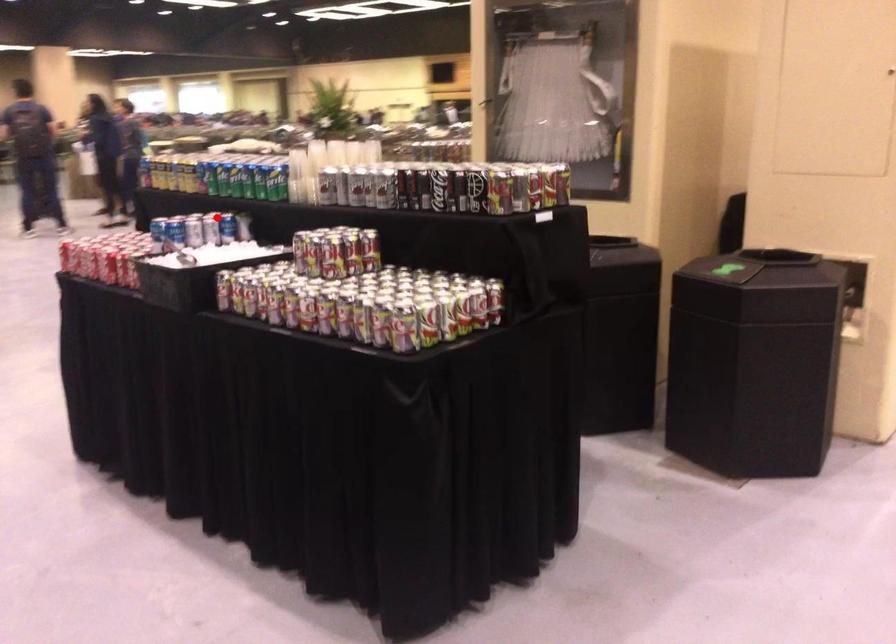
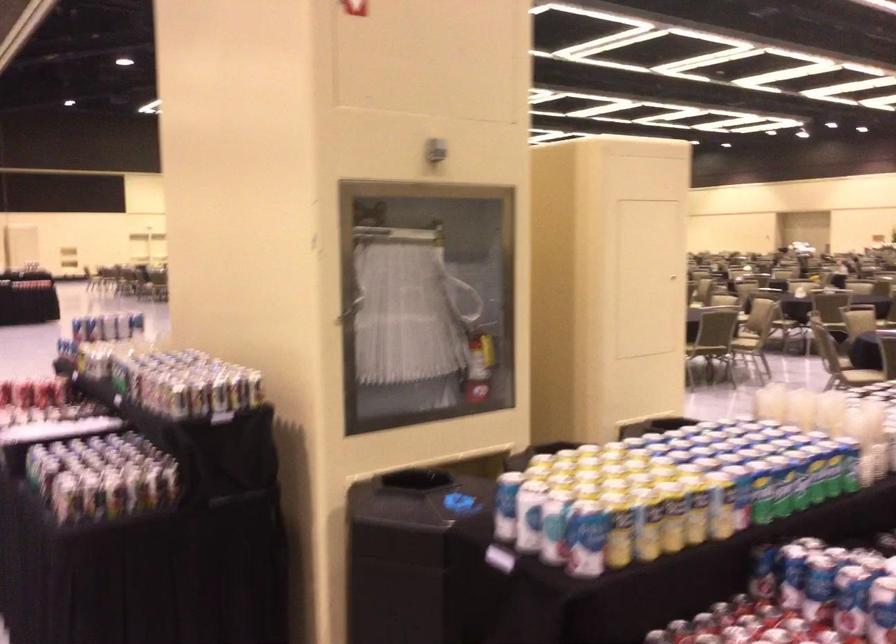
Question: I am providing you with two images of the same scene from different viewpoints. Given a red point in image1, look at the same physical point in image2. Is it:

Choices:
 (A) Closer to the viewpoint
 (B) Farther from the viewpoint

Answer: (A)